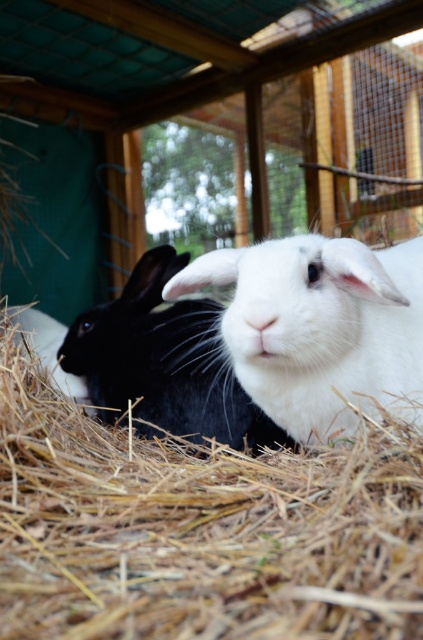
Question: Which of the following is the closest to the observer?

Choices:
 (A) (99, 376)
 (B) (225, 522)
 (C) (414, 364)

Answer: (B)

Question: Does straw hay at center have a larger size compared to black soft fur rabbit at left?

Choices:
 (A) no
 (B) yes

Answer: (A)

Question: Which point is farther to the camera?

Choices:
 (A) straw hay at center
 (B) black soft fur rabbit at left

Answer: (B)

Question: Based on their relative distances, which object is nearer to the straw hay at center?

Choices:
 (A) white soft fur rabbit at center
 (B) black soft fur rabbit at left

Answer: (A)

Question: Can you confirm if straw hay at center is wider than black soft fur rabbit at left?

Choices:
 (A) yes
 (B) no

Answer: (A)

Question: Is straw hay at center thinner than black soft fur rabbit at left?

Choices:
 (A) no
 (B) yes

Answer: (A)